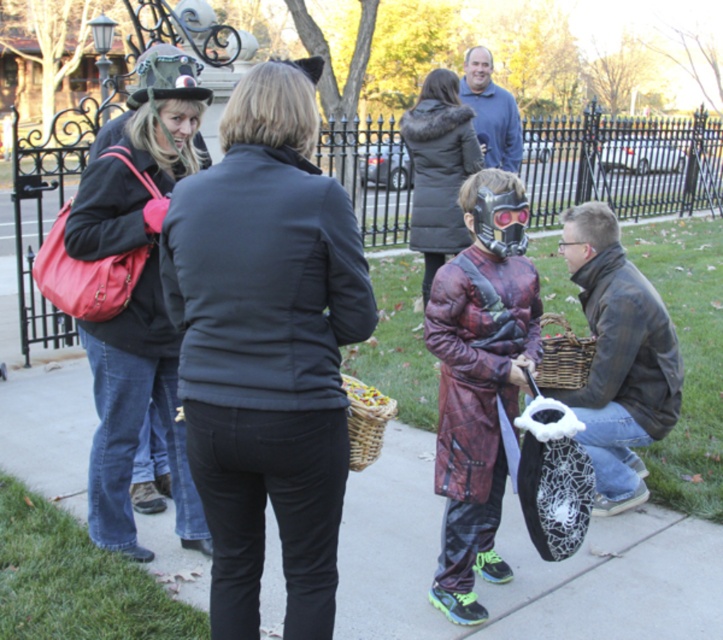
You are organizing a clothing donation drive and need to determine if the red plaid coat at center and the leather jacket at lower right can fit side by side on a 1.2 meter wide display rack. Based on their widths, will they both fit?

The red plaid coat at center has a lesser width compared to leather jacket at lower right. To determine if they can fit side by side, we need to know the combined width of both items. However, the exact widths arenot provided. Without specific measurements, it is impossible to confirm if their combined width is less than or equal to 1.2 meters. Additional information about each item s individual width is required to make this determination.